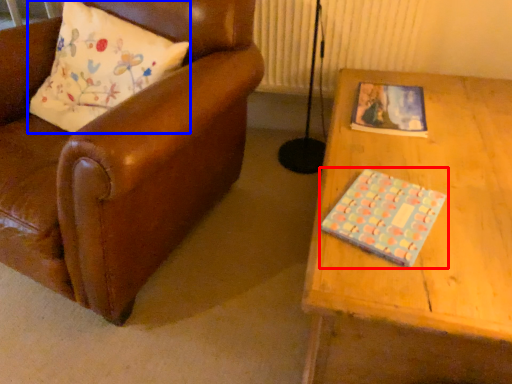
Question: Which object is closer to the camera taking this photo, book (highlighted by a red box) or pillow (highlighted by a blue box)?

Choices:
 (A) book
 (B) pillow

Answer: (A)